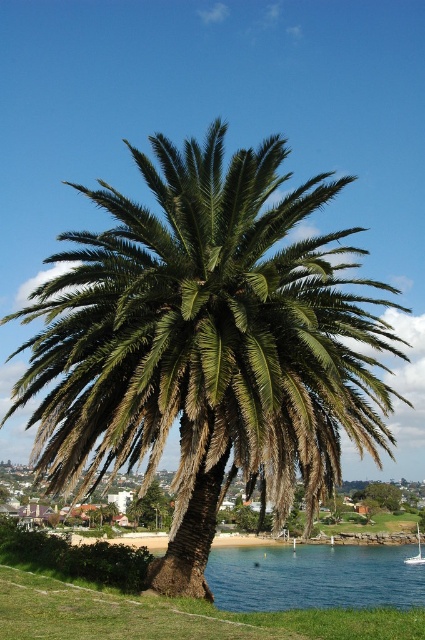
You are standing at the center of the image and want to locate the green leafy palm. What are the coordinates of the green leafy palm at center?

The green leafy palm at center is located at coordinates point (150,508).

You are a delivery drone that needs to fly from the green leafy palm tree at center to the white glossy sailboat at lower right. What is the minimum distance you must cover to reach your destination?

The minimum distance between the green leafy palm tree at center and the white glossy sailboat at lower right is 105.01 meters, so you must cover at least 105.01 meters to reach the destination.

You are standing on the beach looking towards the palm tree. Which object is closer to your left side, the green leafy palm at center or the white glossy sailboat at lower right?

The green leafy palm at center is closer to your left side because it is positioned to the left of the white glossy sailboat at lower right.